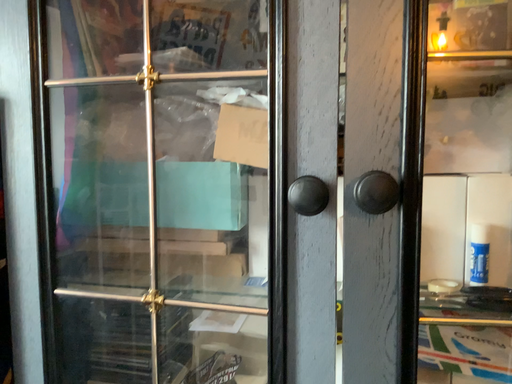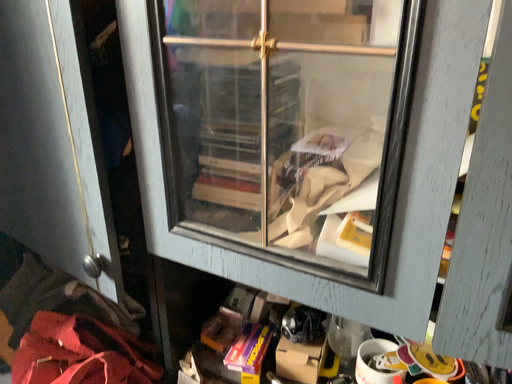
Question: How did the camera likely rotate when shooting the video?

Choices:
 (A) rotated right
 (B) rotated left

Answer: (B)